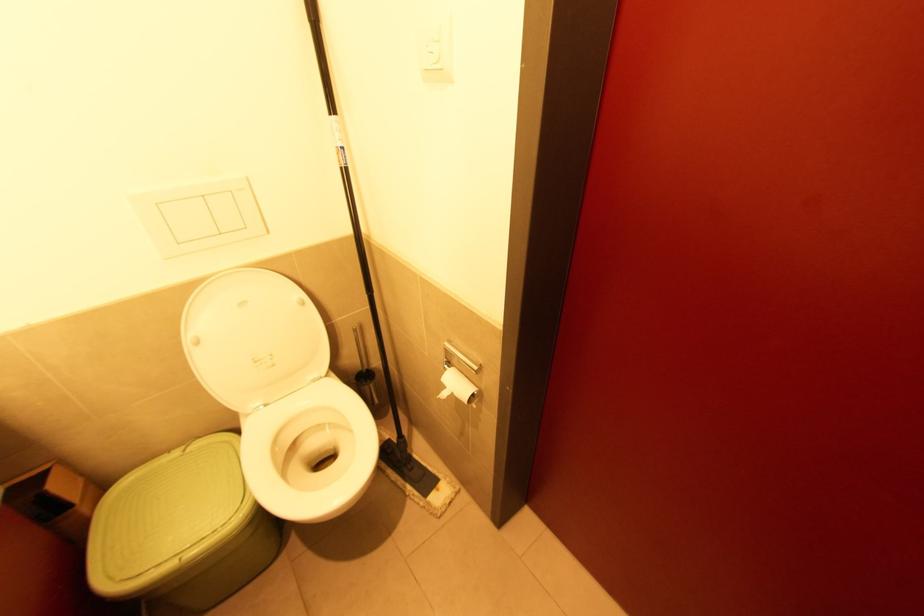
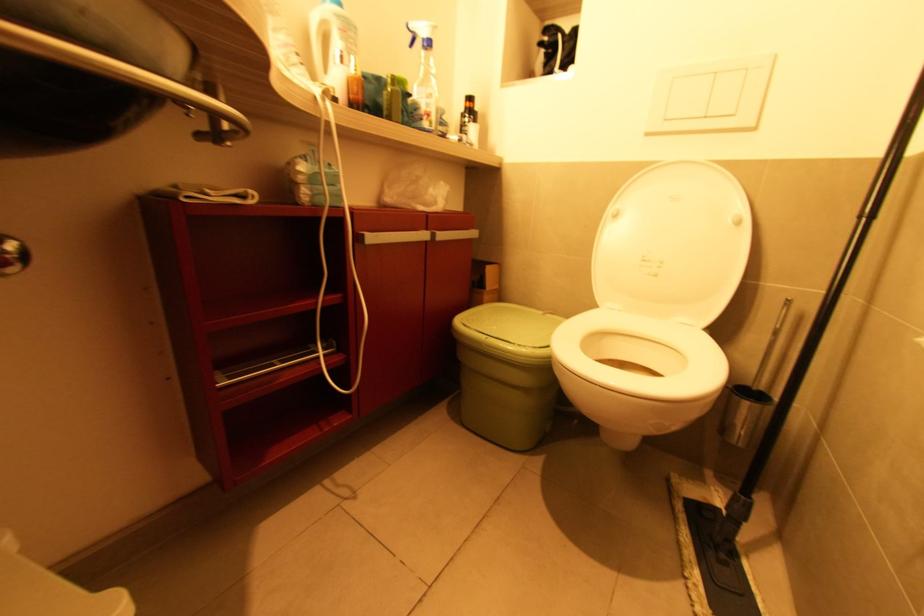
In the second image, find the point that corresponds to pixel 355 345 in the first image.

(771, 338)